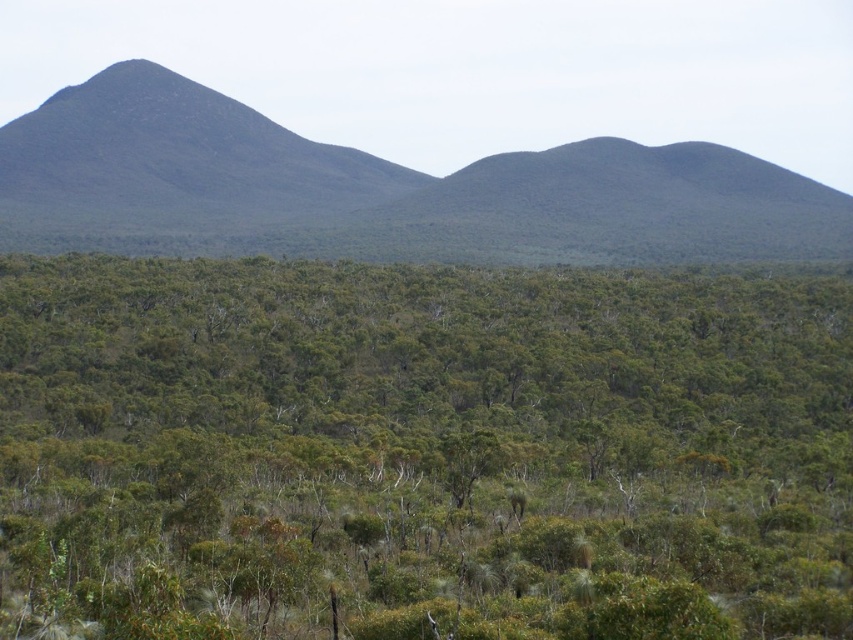
Question: Does dark green textured mountain at left appear over dark brown rocky mountain at left?

Choices:
 (A) yes
 (B) no

Answer: (B)

Question: Among these points, which one is nearest to the camera?

Choices:
 (A) (167, 88)
 (B) (432, 458)

Answer: (B)

Question: Estimate the real-world distances between objects in this image. Which object is farther from the green leafy shrub at center?

Choices:
 (A) dark brown rocky mountain at left
 (B) dark green textured mountain at left

Answer: (A)

Question: Is green leafy shrub at center positioned before dark green textured mountain at left?

Choices:
 (A) yes
 (B) no

Answer: (A)

Question: Which point appears farthest from the camera in this image?

Choices:
 (A) (798, 177)
 (B) (775, 429)
 (C) (198, 115)

Answer: (C)

Question: From the image, what is the correct spatial relationship of dark green textured mountain at left in relation to dark brown rocky mountain at left?

Choices:
 (A) below
 (B) above

Answer: (A)